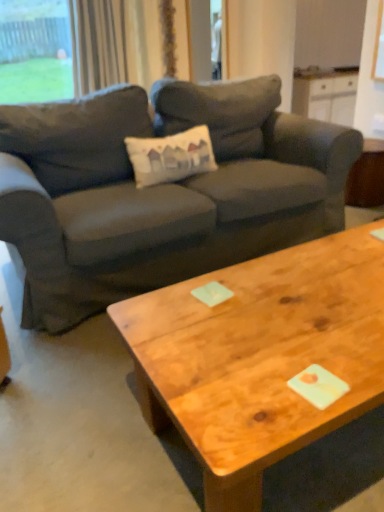
Question: Can you confirm if wooden coffee table at center is thinner than green glass window at upper left?

Choices:
 (A) no
 (B) yes

Answer: (A)

Question: Is wooden coffee table at center smaller than green glass window at upper left?

Choices:
 (A) no
 (B) yes

Answer: (A)

Question: Considering the relative sizes of wooden coffee table at center and green glass window at upper left in the image provided, is wooden coffee table at center taller than green glass window at upper left?

Choices:
 (A) no
 (B) yes

Answer: (A)

Question: Considering the relative positions of wooden coffee table at center and green glass window at upper left in the image provided, is wooden coffee table at center to the right of green glass window at upper left from the viewer's perspective?

Choices:
 (A) no
 (B) yes

Answer: (B)

Question: From the image's perspective, is wooden coffee table at center located beneath green glass window at upper left?

Choices:
 (A) yes
 (B) no

Answer: (A)

Question: Is wooden coffee table at center shorter than green glass window at upper left?

Choices:
 (A) yes
 (B) no

Answer: (A)

Question: Can you confirm if wooden coffee table at center is thinner than light beige fabric curtain at upper left?

Choices:
 (A) no
 (B) yes

Answer: (A)

Question: From a real-world perspective, does wooden coffee table at center stand above light beige fabric curtain at upper left?

Choices:
 (A) no
 (B) yes

Answer: (A)

Question: From the image's perspective, is wooden coffee table at center beneath light beige fabric curtain at upper left?

Choices:
 (A) yes
 (B) no

Answer: (A)

Question: From the image's perspective, is wooden coffee table at center over light beige fabric curtain at upper left?

Choices:
 (A) no
 (B) yes

Answer: (A)

Question: Does wooden coffee table at center have a smaller size compared to light beige fabric curtain at upper left?

Choices:
 (A) yes
 (B) no

Answer: (B)

Question: Can you confirm if wooden coffee table at center is taller than light beige fabric curtain at upper left?

Choices:
 (A) no
 (B) yes

Answer: (A)

Question: Would you say green glass window at upper left is a long distance from wooden side table at right?

Choices:
 (A) no
 (B) yes

Answer: (B)